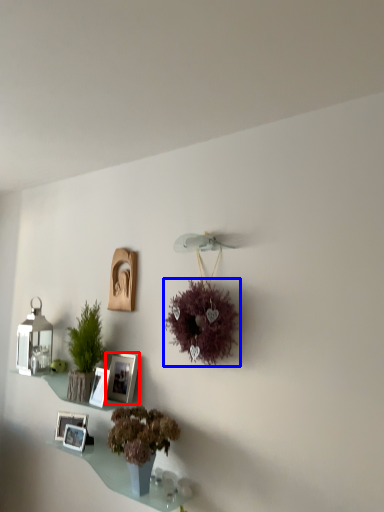
Question: Which point is further to the camera, picture frame (highlighted by a red box) or flower (highlighted by a blue box)?

Choices:
 (A) picture frame
 (B) flower

Answer: (A)